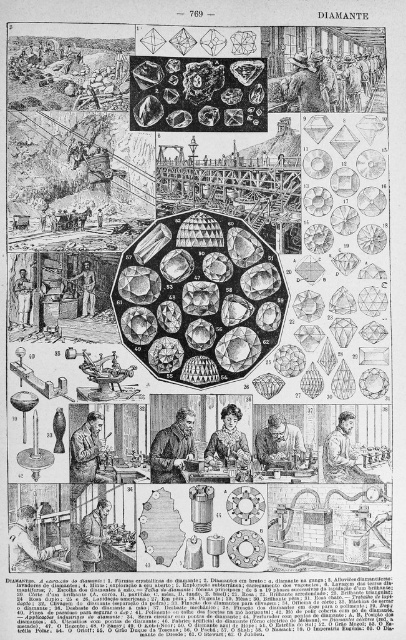
Question: Estimate the real-world distances between objects in this image. Which object is closer to the shiny diamond at center?

Choices:
 (A) wooden crate at center
 (B) smooth wooden hand at center

Answer: (A)

Question: Is smooth skin face at center wider than wooden crate at center?

Choices:
 (A) no
 (B) yes

Answer: (B)

Question: Is smooth wooden hand at center behind wooden figure at center?

Choices:
 (A) yes
 (B) no

Answer: (B)

Question: Which point appears closest to the camera in this image?

Choices:
 (A) (203, 124)
 (B) (82, 435)
 (C) (263, 435)

Answer: (B)

Question: Does black leather jacket at center come behind smooth wooden hand at center?

Choices:
 (A) no
 (B) yes

Answer: (A)

Question: Which of the following is the closest to the observer?

Choices:
 (A) smooth wooden hand at center
 (B) wooden figure at center

Answer: (A)